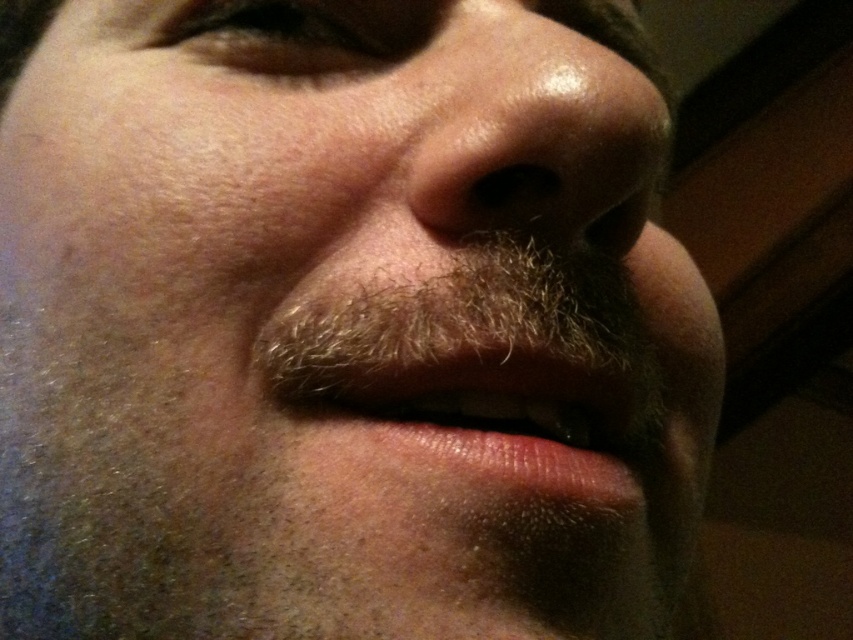
This screenshot has width=853, height=640. Describe the element at coordinates (485, 348) in the screenshot. I see `smooth skin mouth at center` at that location.

Based on the photo, does smooth skin mouth at center have a lesser height compared to brown textured eye at upper center?

Incorrect, smooth skin mouth at center's height does not fall short of brown textured eye at upper center's.

Does point (376, 305) come behind point (172, 17)?

No.

This screenshot has height=640, width=853. Find the location of `smooth skin mouth at center`. smooth skin mouth at center is located at coordinates coord(485,348).

From the picture: Who is positioned more to the right, shiny skin nose at center or brown textured eye at upper center?

From the viewer's perspective, shiny skin nose at center appears more on the right side.

Based on the photo, is shiny skin nose at center below brown textured eye at upper center?

Yes.

Is point (578, 102) in front of point (318, 33)?

Yes, it is.

Where is `shiny skin nose at center`? The image size is (853, 640). shiny skin nose at center is located at coordinates (541, 129).

Between smooth skin mouth at center and shiny skin nose at center, which one is positioned lower?

smooth skin mouth at center is below.

Is smooth skin mouth at center closer to camera compared to shiny skin nose at center?

That is False.

Which is in front, point (639, 381) or point (465, 216)?

Point (465, 216) is more forward.

Find the location of a particular element. smooth skin mouth at center is located at coordinates (485, 348).